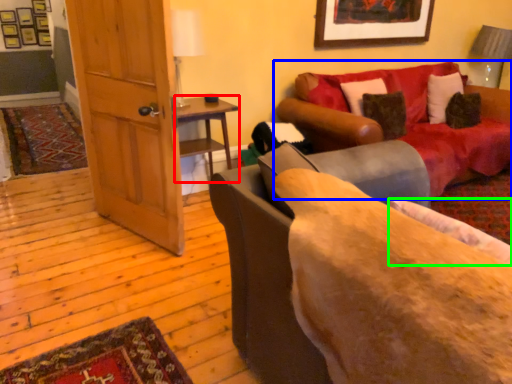
Question: Estimate the real-world distances between objects in this image. Which object is closer to table (highlighted by a red box), studio couch (highlighted by a blue box) or pillow (highlighted by a green box)?

Choices:
 (A) studio couch
 (B) pillow

Answer: (A)